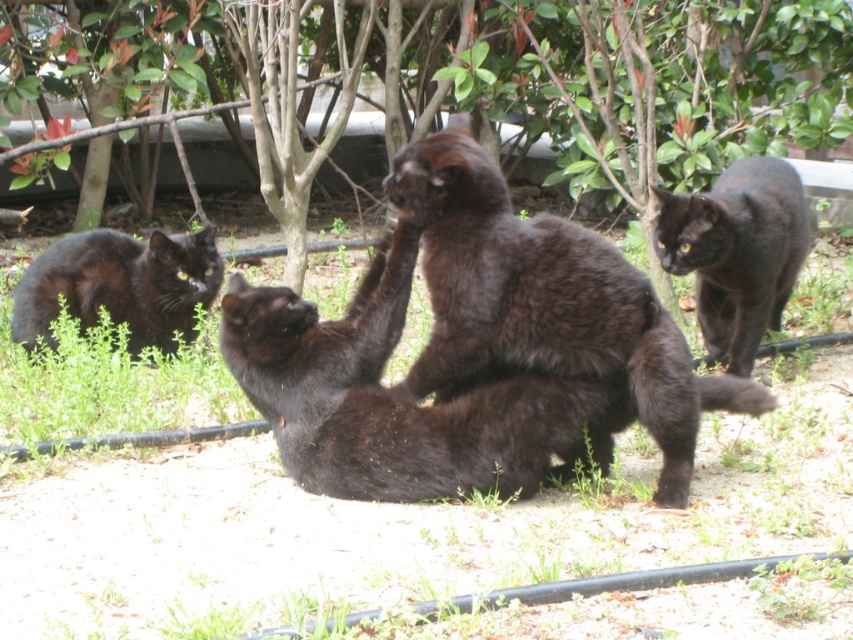
Question: Based on their relative distances, which object is farther from the matte black cat at left?

Choices:
 (A) shiny dark brown cat at center
 (B) matte black cat at upper right

Answer: (B)

Question: Among these points, which one is farthest from the camera?

Choices:
 (A) (213, 234)
 (B) (413, 262)
 (C) (804, 209)

Answer: (A)

Question: Can you confirm if shiny dark brown cat at center is positioned to the left of shiny black cat at center?

Choices:
 (A) yes
 (B) no

Answer: (B)

Question: Is matte black cat at upper right above matte black cat at left?

Choices:
 (A) yes
 (B) no

Answer: (A)

Question: Which object is the closest to the matte black cat at left?

Choices:
 (A) shiny dark brown cat at center
 (B) shiny black cat at center
 (C) matte black cat at upper right

Answer: (B)

Question: Is shiny dark brown cat at center to the right of shiny black cat at center from the viewer's perspective?

Choices:
 (A) yes
 (B) no

Answer: (A)